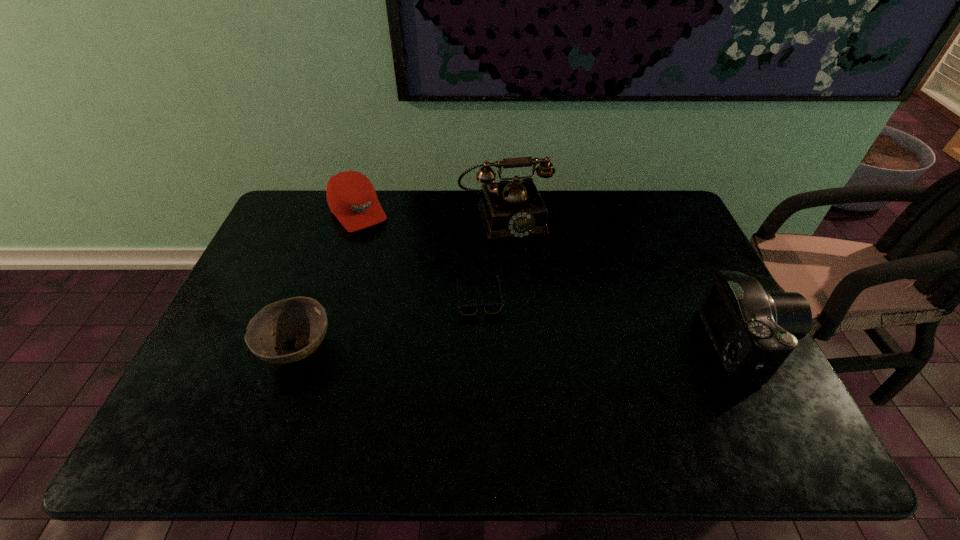
Locate an element on the screen. The width and height of the screenshot is (960, 540). free space that is in between the tallest object and the second shortest object is located at coordinates (400, 282).

The height and width of the screenshot is (540, 960). Identify the location of vacant point located between the shortest object and the cap. (419, 254).

This screenshot has height=540, width=960. What are the coordinates of `free point between the tallest object and the fourth tallest object` in the screenshot? It's located at (400, 282).

The width and height of the screenshot is (960, 540). In order to click on object that is the fourth closest to the sunglasses in this screenshot , I will do `click(754, 331)`.

You are a GUI agent. You are given a task and a screenshot of the screen. Output one action in this format:
    pyautogui.click(x=<x>, y=<y>)
    Task: Click on the object that is the fourth closest to the cap
    The width and height of the screenshot is (960, 540).
    Given the screenshot: What is the action you would take?
    pyautogui.click(x=754, y=331)

You are a GUI agent. You are given a task and a screenshot of the screen. Output one action in this format:
    pyautogui.click(x=<x>, y=<y>)
    Task: Click on the free space in the image that satisfies the following two spatial constraints: 1. on the back side of the telephone; 2. on the right side of the shortest object
    The width and height of the screenshot is (960, 540).
    Given the screenshot: What is the action you would take?
    pyautogui.click(x=480, y=217)

You are a GUI agent. You are given a task and a screenshot of the screen. Output one action in this format:
    pyautogui.click(x=<x>, y=<y>)
    Task: Click on the free space that satisfies the following two spatial constraints: 1. on the back side of the third tallest object; 2. on the right side of the bowl
    The image size is (960, 540).
    Given the screenshot: What is the action you would take?
    pyautogui.click(x=346, y=212)